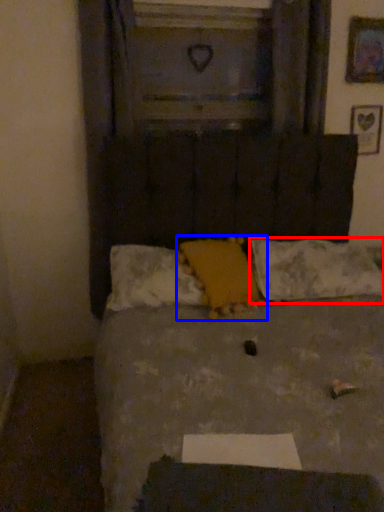
Question: Which object is further to the camera taking this photo, pillow (highlighted by a red box) or pillow (highlighted by a blue box)?

Choices:
 (A) pillow
 (B) pillow

Answer: (A)